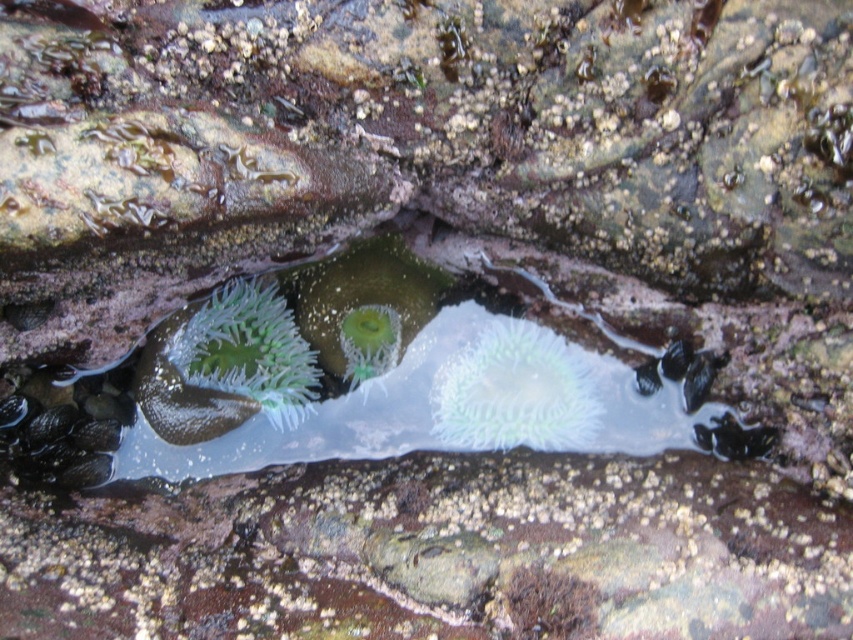
Question: Which point is farther from the camera taking this photo?

Choices:
 (A) (532, 435)
 (B) (247, 330)

Answer: (A)

Question: Which object is closer to the camera taking this photo?

Choices:
 (A) green translucent anemone at center
 (B) translucent gelatinous anemone at center

Answer: (A)

Question: Does translucent gelatinous anemone at center lie in front of green translucent anemone at center?

Choices:
 (A) no
 (B) yes

Answer: (A)

Question: Is translucent gelatinous anemone at center to the right of green translucent anemone at center from the viewer's perspective?

Choices:
 (A) no
 (B) yes

Answer: (B)

Question: Is translucent gelatinous anemone at center further to the viewer compared to green translucent anemone at center?

Choices:
 (A) no
 (B) yes

Answer: (B)